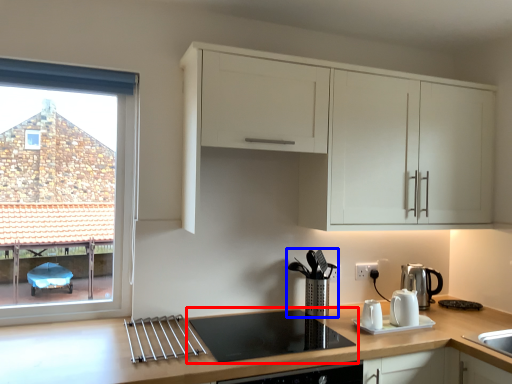
Question: Among these objects, which one is farthest to the camera, gas stove (highlighted by a red box) or coffee machine (highlighted by a blue box)?

Choices:
 (A) gas stove
 (B) coffee machine

Answer: (B)